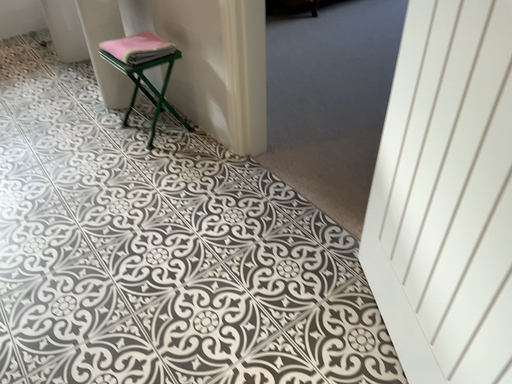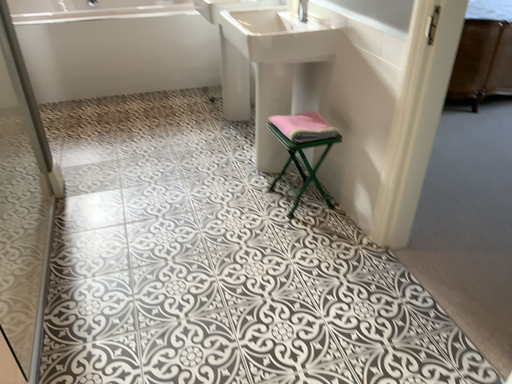
Question: Which way did the camera rotate in the video?

Choices:
 (A) rotated downward
 (B) rotated upward

Answer: (B)